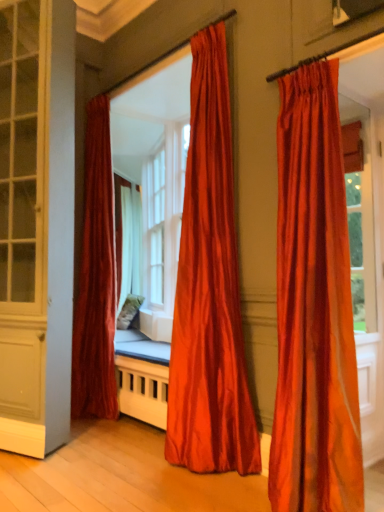
You are a GUI agent. You are given a task and a screenshot of the screen. Output one action in this format:
    pyautogui.click(x=<x>, y=<y>)
    Task: Click on the vacant area to the left of satin orange curtain at center, arranged as the second curtain when viewed from the front
    
    Given the screenshot: What is the action you would take?
    pyautogui.click(x=132, y=472)